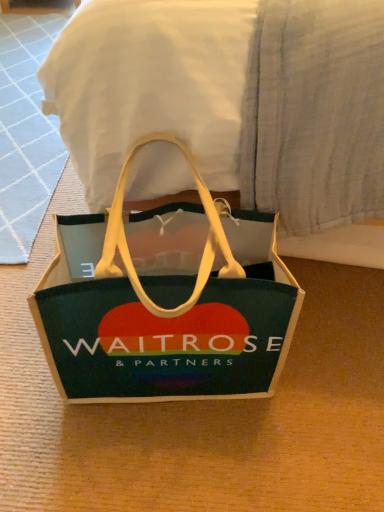
This screenshot has height=512, width=384. Find the location of `vacant area located to the right-hand side of green felt bag at center`. vacant area located to the right-hand side of green felt bag at center is located at coordinates (322, 379).